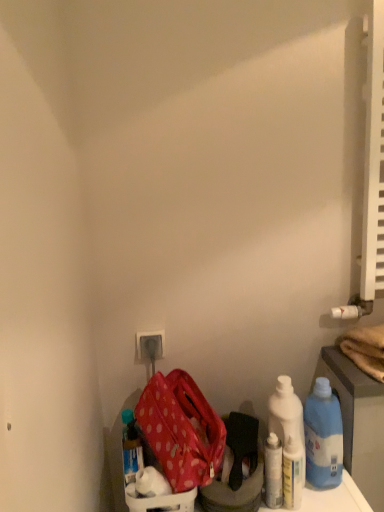
Question: Is point (273, 500) positioned closer to the camera than point (152, 336)?

Choices:
 (A) farther
 (B) closer

Answer: (B)

Question: In terms of size, does white glossy bottle at lower right, arranged as the 2th bottle when viewed from the left, appear bigger or smaller than white plastic electric outlet at lower center?

Choices:
 (A) big
 (B) small

Answer: (A)

Question: Which of these objects is positioned closest to the white plastic electric outlet at lower center?

Choices:
 (A) blue plastic bottle at lower right, acting as the first bottle starting from the right
 (B) blue plastic bottle at lower left, marked as the first bottle in a left-to-right arrangement
 (C) white glossy bottle at lower right, marked as the third bottle in a right-to-left arrangement
 (D) polka dot fabric bag at lower left
 (E) white glossy bottle at lower right, placed as the third bottle when sorted from left to right

Answer: (B)

Question: Which object is positioned farthest from the white plastic electric outlet at lower center?

Choices:
 (A) blue plastic bottle at lower right, which ranks as the 4th bottle in left-to-right order
 (B) blue plastic bottle at lower left, marked as the first bottle in a left-to-right arrangement
 (C) white plastic bottles at center right
 (D) polka dot fabric bag at lower left
 (E) white glossy bottle at lower right, arranged as the 2th bottle when viewed from the left

Answer: (A)